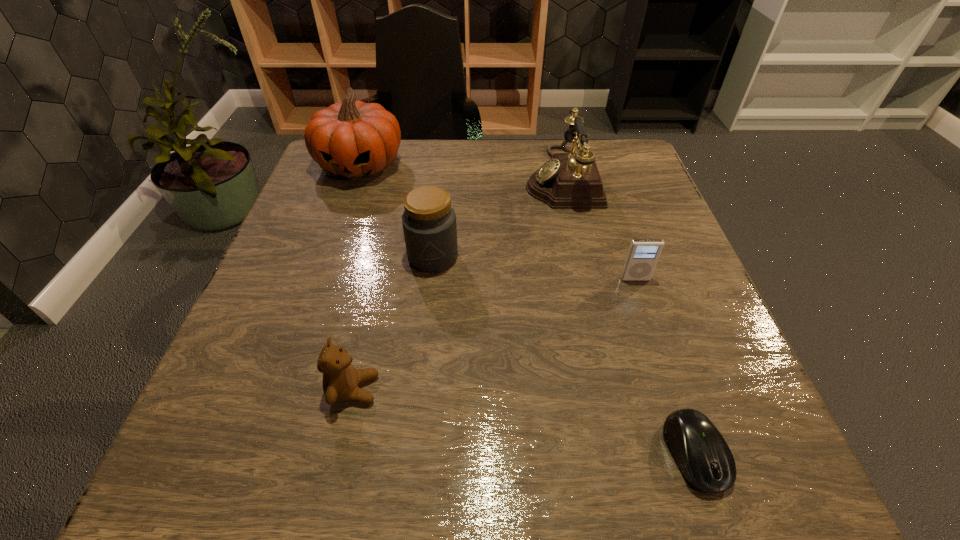
Locate an element on the screen. Image resolution: width=960 pixels, height=540 pixels. blank space located 0.170m on the dial of the telephone is located at coordinates (455, 177).

Identify the location of free location located on the surface of the third object from left to right near the warning symbol. (420, 374).

The width and height of the screenshot is (960, 540). What are the coordinates of `vacant area located on the front-facing side of the teddy bear` in the screenshot? It's located at (429, 389).

Identify the location of vacant space located on the front-facing side of the iPod. This screenshot has height=540, width=960. (697, 463).

Where is `free location located on the back of the mouse`? Image resolution: width=960 pixels, height=540 pixels. free location located on the back of the mouse is located at coordinates (667, 374).

I want to click on pumpkin at the far edge, so click(353, 139).

Image resolution: width=960 pixels, height=540 pixels. Find the location of `telephone that is at the far edge`. telephone that is at the far edge is located at coordinates (570, 180).

I want to click on object that is at the near edge, so click(x=704, y=458).

Find the location of a particular element. The width and height of the screenshot is (960, 540). object that is at the left edge is located at coordinates (353, 139).

Identify the location of telephone that is at the right edge. The width and height of the screenshot is (960, 540). (570, 180).